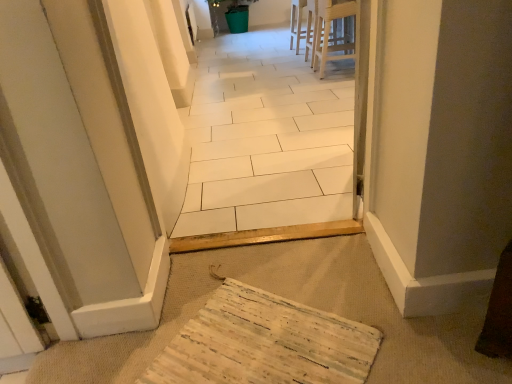
Question: Is light wood stool at upper center inside the boundaries of white wood chair at upper center, or outside?

Choices:
 (A) inside
 (B) outside

Answer: (B)

Question: Considering the positions of light wood stool at upper center and white wood chair at upper center in the image, is light wood stool at upper center taller or shorter than white wood chair at upper center?

Choices:
 (A) tall
 (B) short

Answer: (A)

Question: Estimate the real-world distances between objects in this image. Which object is closer to the light wood stool at upper center?

Choices:
 (A) white wood chair at upper center
 (B) wooden textured mat at lower center
 (C) white tile floor at center

Answer: (A)

Question: Considering the real-world distances, which object is farthest from the white wood chair at upper center?

Choices:
 (A) wooden textured mat at lower center
 (B) white tile floor at center
 (C) light wood stool at upper center

Answer: (A)